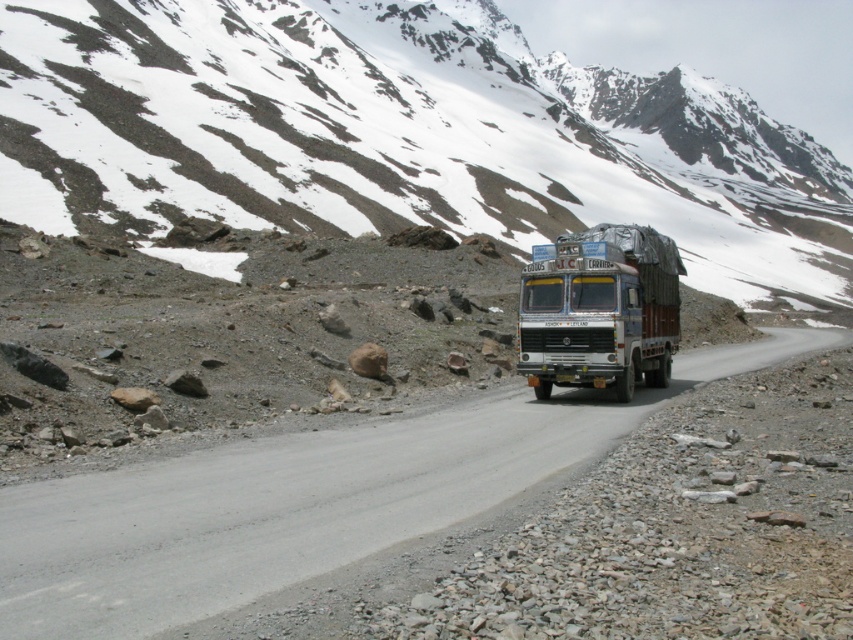
You are a delivery driver navigating through the mountain pass. You see a snowy rock at upper center and a metallic blue trailer truck at center. Which object is larger in size?

The snowy rock at upper center is bigger than the metallic blue trailer truck at center.

You are standing at the viewpoint and want to reach the point marked as point (x=200, y=42). The path to this point is along a narrow mountain road. Your vehicle has a maximum range of 120 meters before needing to refuel. Can you safely reach the point without needing to refuel?

The point (x=200, y=42) is 134.05 meters away from the viewer. Since your vehicle can only travel 120 meters before needing to refuel, you cannot safely reach the point without refueling.